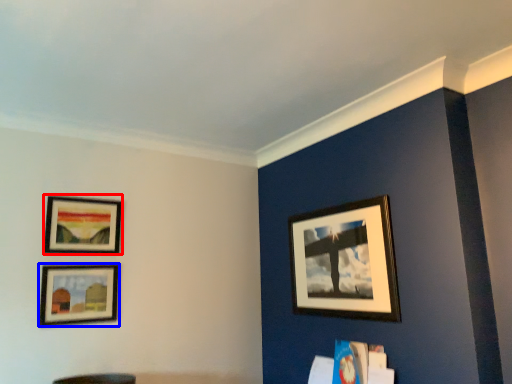
Question: Which object is further to the camera taking this photo, picture frame (highlighted by a red box) or picture frame (highlighted by a blue box)?

Choices:
 (A) picture frame
 (B) picture frame

Answer: (A)